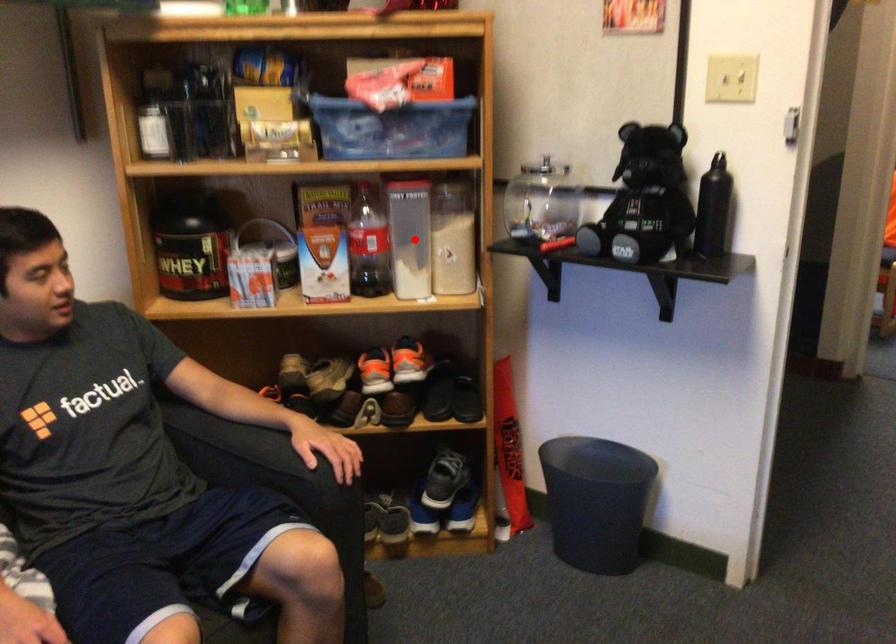
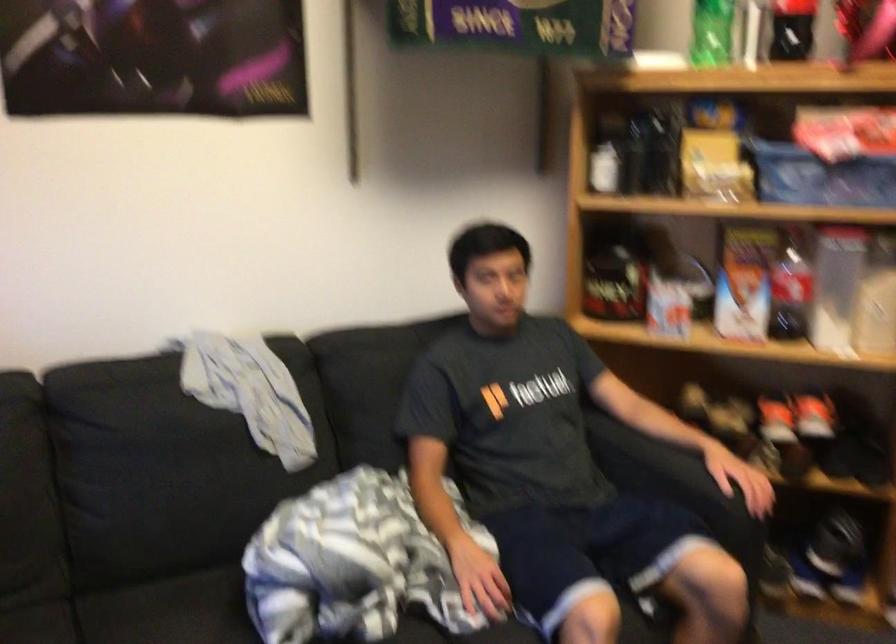
The point at the highlighted location is marked in the first image. Where is the corresponding point in the second image?

(836, 287)